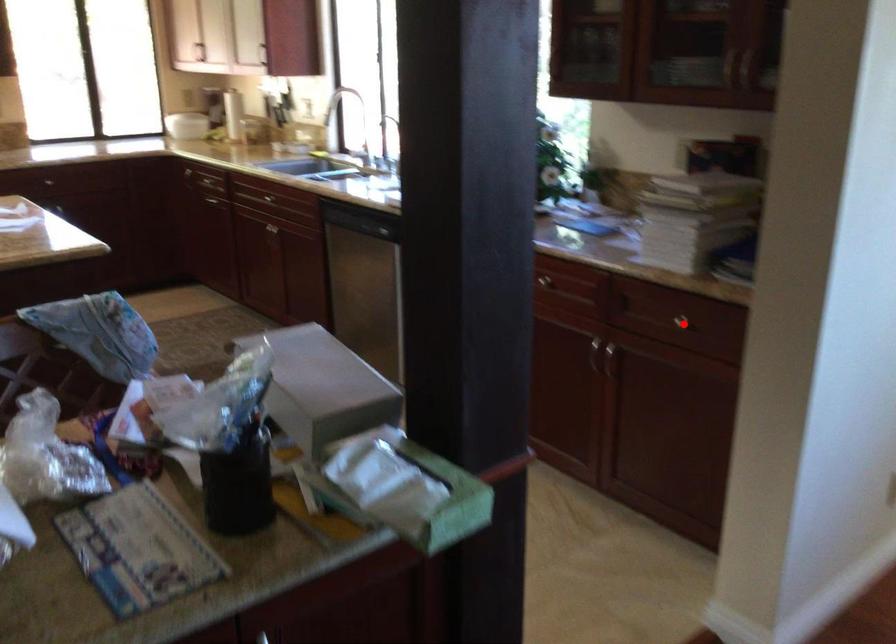
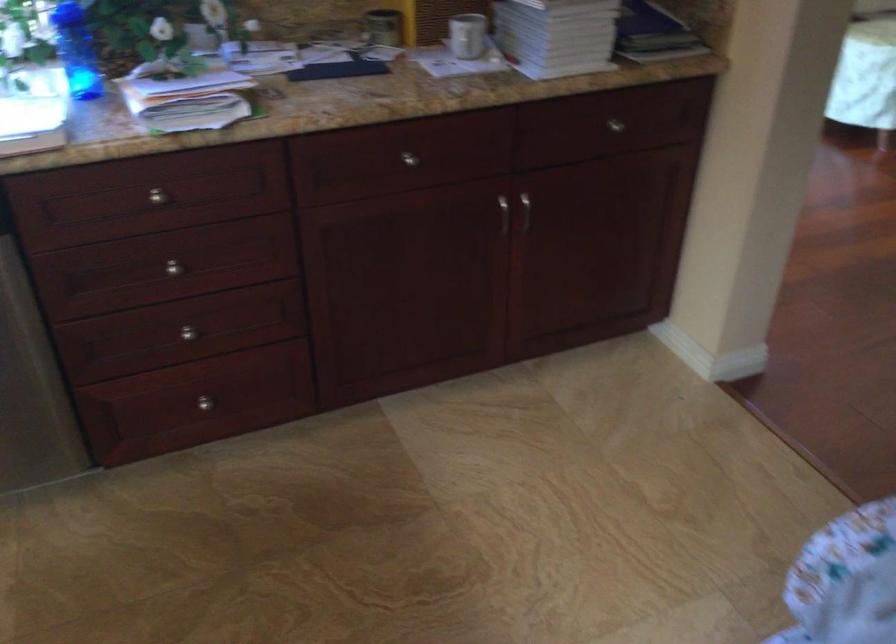
Question: A red point is marked in image1. In image2, is the corresponding 3D point closer to the camera or farther? Reply with the corresponding letter.

Choices:
 (A) The corresponding 3D point is closer.
 (B) The corresponding 3D point is farther.

Answer: (A)